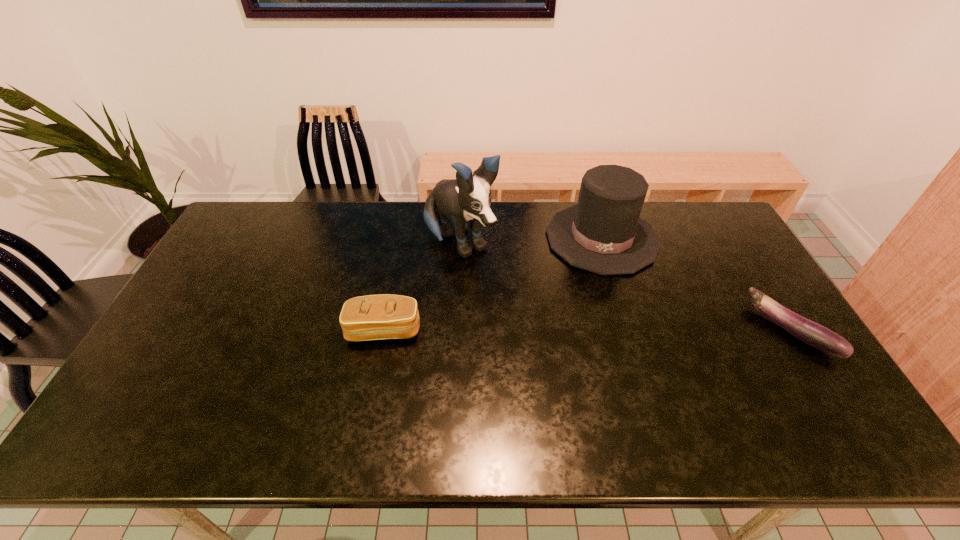
Locate an element on the screen. vacant space located on the front of the second object from right to left with the decoration is located at coordinates point(601,348).

Locate an element on the screen. Image resolution: width=960 pixels, height=540 pixels. free location located 0.140m on the front of the second object from right to left with the decoration is located at coordinates [601, 309].

Locate an element on the screen. The image size is (960, 540). free location located 0.260m on the front of the second object from right to left with the decoration is located at coordinates (601, 342).

Find the location of `puppy that is at the far edge`. puppy that is at the far edge is located at coordinates (468, 197).

The height and width of the screenshot is (540, 960). I want to click on dress hat that is at the far edge, so pos(603,233).

Image resolution: width=960 pixels, height=540 pixels. Find the location of `object at the right edge`. object at the right edge is located at coordinates (810, 332).

In the image, there is a desktop. At what (x,y) coordinates should I click in order to perform the action: click on free space at the far edge. Please return your answer as a coordinate pair (x, y). The width and height of the screenshot is (960, 540). Looking at the image, I should click on (511, 233).

The image size is (960, 540). I want to click on free spot at the near edge of the desktop, so click(587, 402).

In the image, there is a desktop. At what (x,y) coordinates should I click in order to perform the action: click on free space at the left edge. Please return your answer as a coordinate pair (x, y). This screenshot has height=540, width=960. Looking at the image, I should click on click(217, 306).

What are the coordinates of `vacant region at the right edge of the desktop` in the screenshot? It's located at (719, 258).